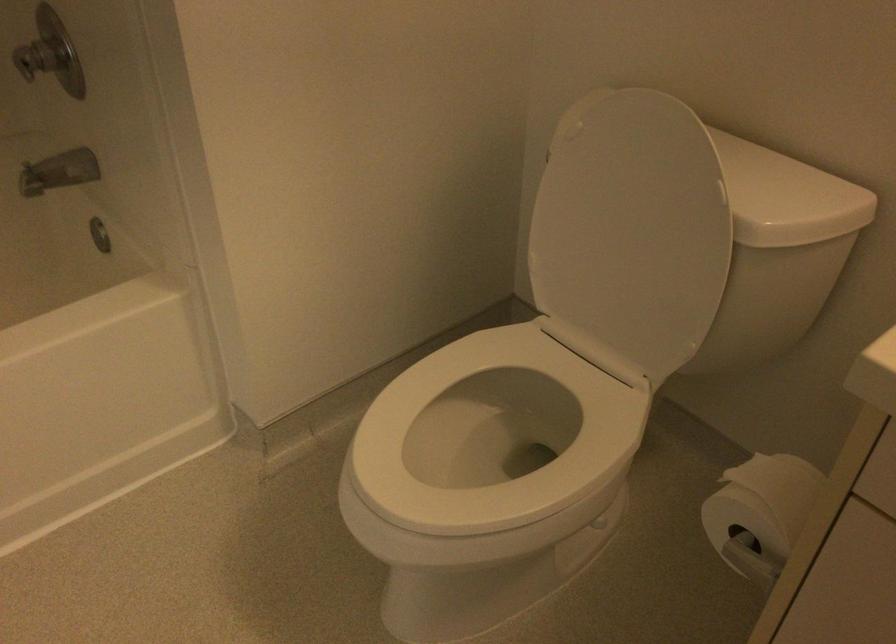
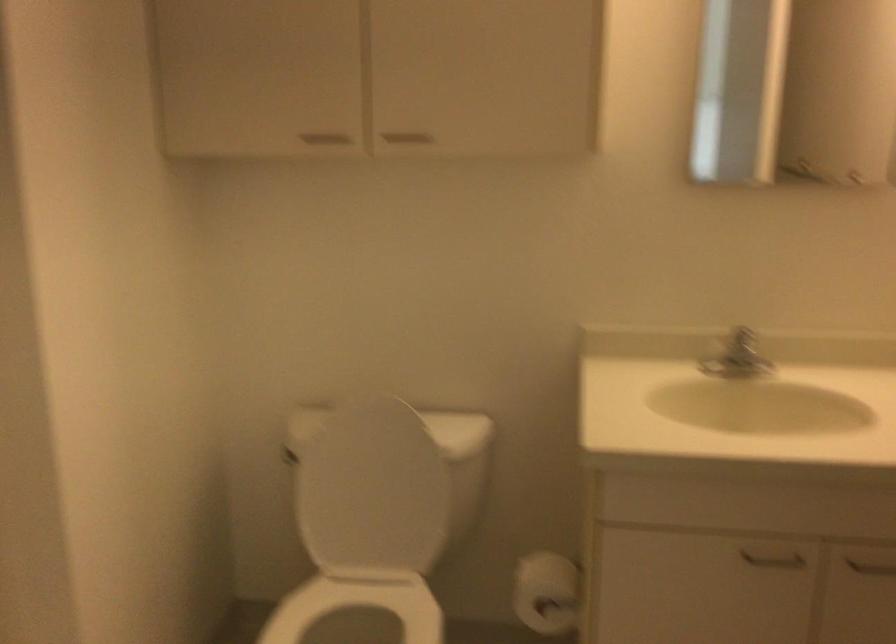
Find the pixel in the second image that matches point 622,242 in the first image.

(373, 491)